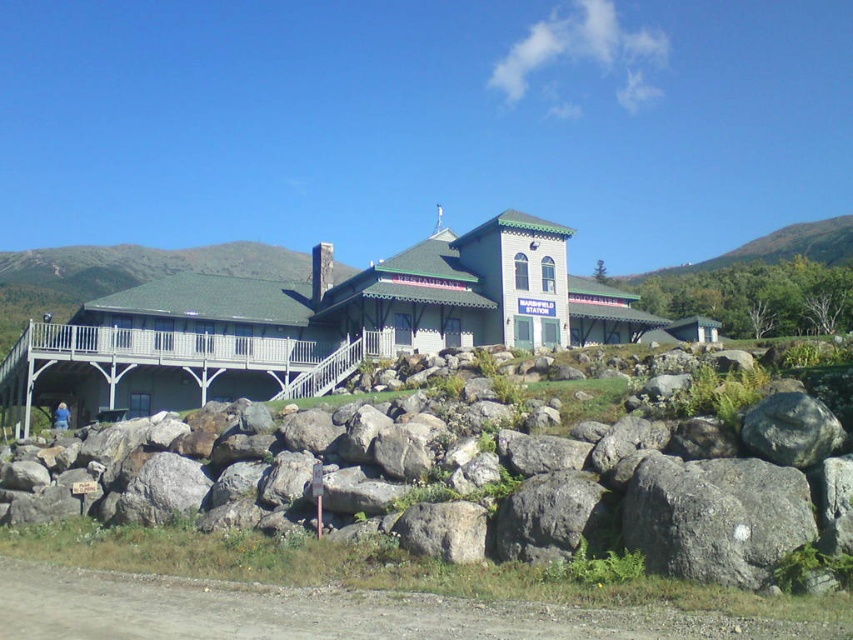
Does wooden porch at center appear over white wooden porch at upper left?

Actually, wooden porch at center is below white wooden porch at upper left.

Is wooden porch at center positioned before white wooden porch at upper left?

Yes, it is.

Who is more distant from viewer, (78, 404) or (213, 348)?

Point (78, 404)

In order to click on wooden porch at center in this screenshot , I will do `click(165, 369)`.

Looking at this image, is gray rock at center thinner than wooden porch at center?

Yes, gray rock at center is thinner than wooden porch at center.

Can you confirm if gray rock at center is bigger than wooden porch at center?

No, gray rock at center is not bigger than wooden porch at center.

The width and height of the screenshot is (853, 640). I want to click on gray rock at center, so [490, 477].

The width and height of the screenshot is (853, 640). Identify the location of gray rock at center. (490, 477).

Can you confirm if gray rock at center is positioned below white wooden porch at upper left?

Yes, gray rock at center is below white wooden porch at upper left.

Does gray rock at center lie behind white wooden porch at upper left?

That is False.

Which is in front, point (4, 481) or point (251, 346)?

Point (4, 481) is more forward.

This screenshot has width=853, height=640. I want to click on gray rock at center, so click(x=490, y=477).